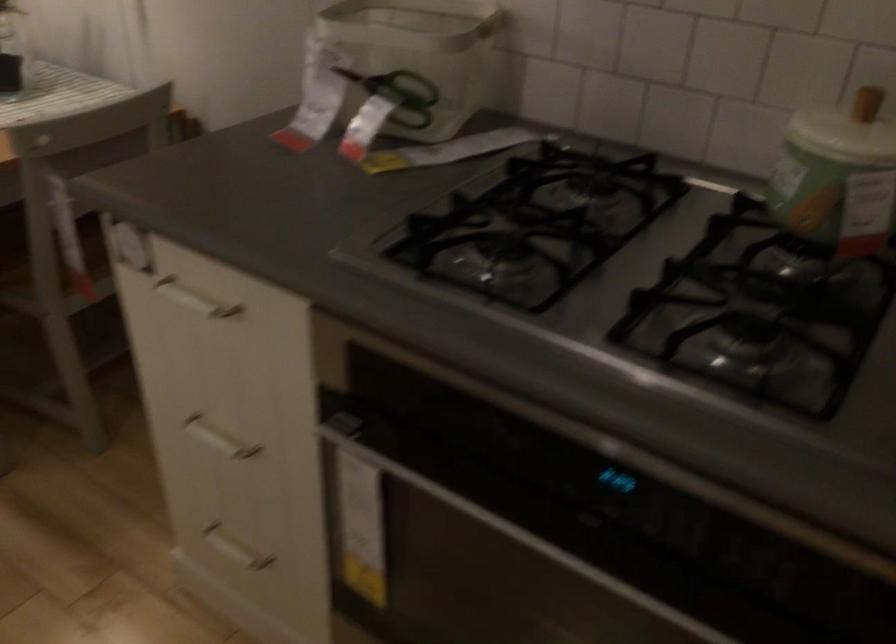
Find where to pull the jar lid knob. Please return your answer as a coordinate pair (x, y).

(866, 102)